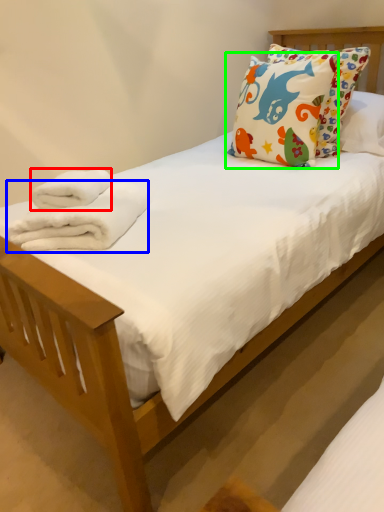
Question: Considering the real-world distances, which object is farthest from bath towel (highlighted by a red box)? bath towel (highlighted by a blue box) or pillow (highlighted by a green box)?

Choices:
 (A) bath towel
 (B) pillow

Answer: (B)